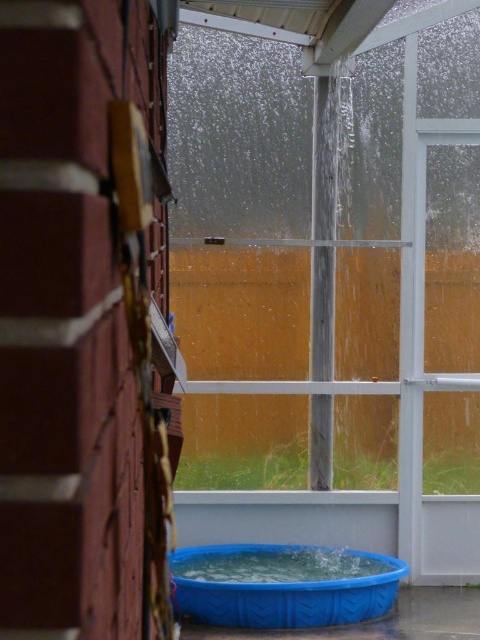
You are a child trying to decide whether to place a small toy boat in the blue plastic pool at lower center or under the transparent plastic window at center. Which location has a surface that is wider, allowing the boat to move more freely?

The transparent plastic window at center is wider than the blue plastic pool at lower center, so placing the boat there would provide more space for movement.